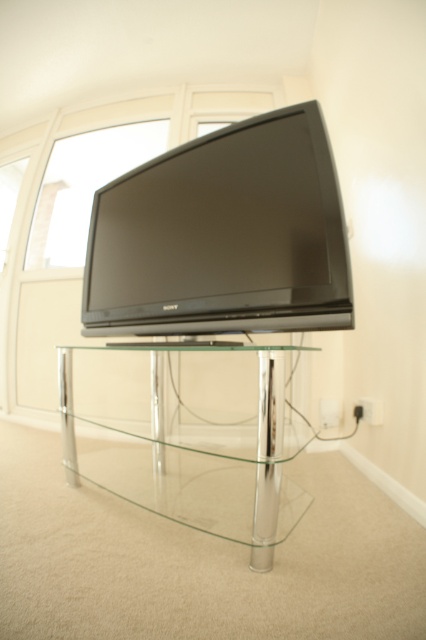
Who is positioned more to the right, black glossy flat screen tv at center or transparent glass table at center?

From the viewer's perspective, transparent glass table at center appears more on the right side.

At what (x,y) coordinates should I click in order to perform the action: click on black glossy flat screen tv at center. Please return your answer as a coordinate pair (x, y). This screenshot has width=426, height=640. Looking at the image, I should click on (222, 236).

Who is more distant from viewer, (250, 232) or (299, 500)?

The point (299, 500) is behind.

You are a GUI agent. You are given a task and a screenshot of the screen. Output one action in this format:
    pyautogui.click(x=<x>, y=<y>)
    Task: Click on the black glossy flat screen tv at center
    
    Given the screenshot: What is the action you would take?
    pyautogui.click(x=222, y=236)